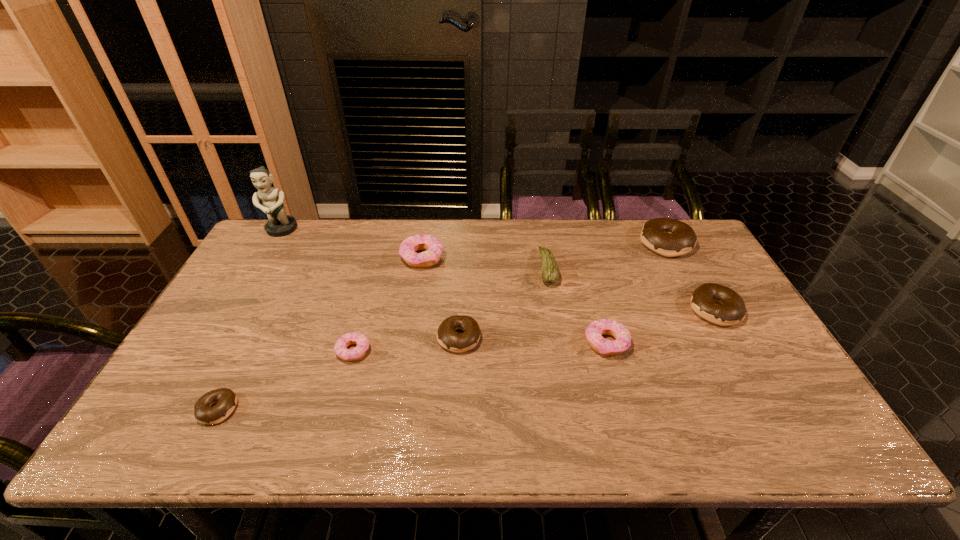
The height and width of the screenshot is (540, 960). Find the location of `vacant space that satisfies the following two spatial constraints: 1. on the front-facing side of the fifth object from right to left; 2. on the right side of the figurine`. vacant space that satisfies the following two spatial constraints: 1. on the front-facing side of the fifth object from right to left; 2. on the right side of the figurine is located at coordinates (218, 338).

Locate an element on the screen. free location that satisfies the following two spatial constraints: 1. on the back side of the second biggest pink doughnut; 2. at the stem end of the green zucchini is located at coordinates (586, 268).